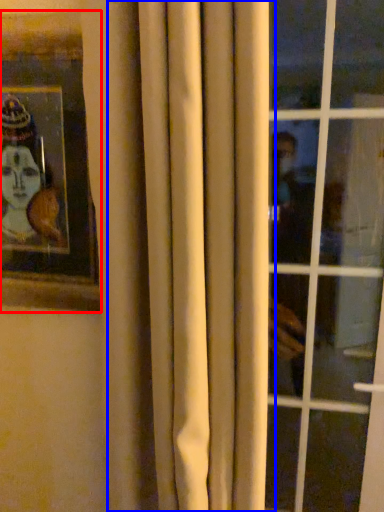
Question: Which of the following is the farthest to the observer, picture frame (highlighted by a red box) or curtain (highlighted by a blue box)?

Choices:
 (A) picture frame
 (B) curtain

Answer: (A)